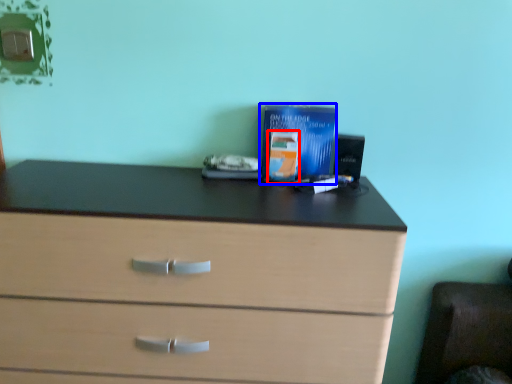
Question: Which object is closer to the camera taking this photo, paperback book (highlighted by a red box) or paperback book (highlighted by a blue box)?

Choices:
 (A) paperback book
 (B) paperback book

Answer: (A)